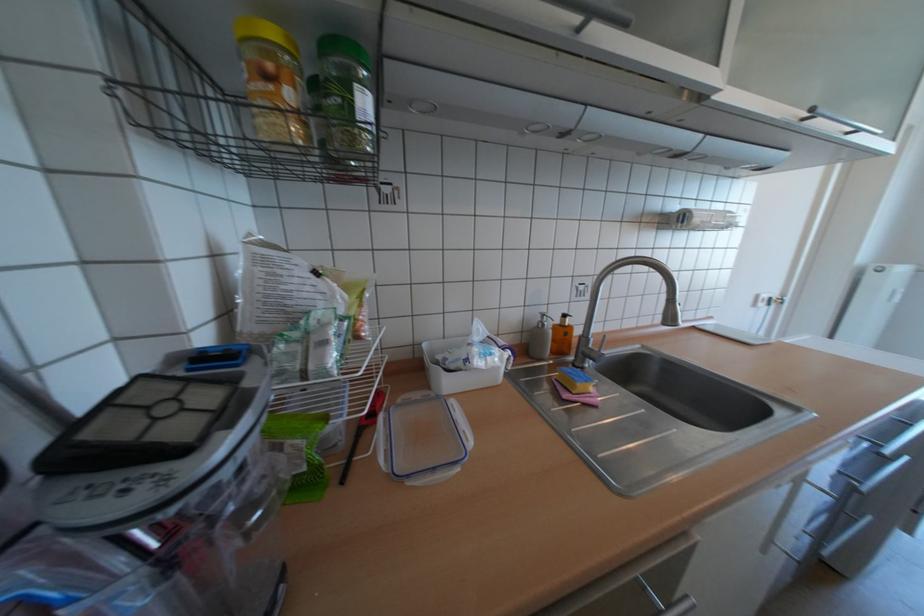
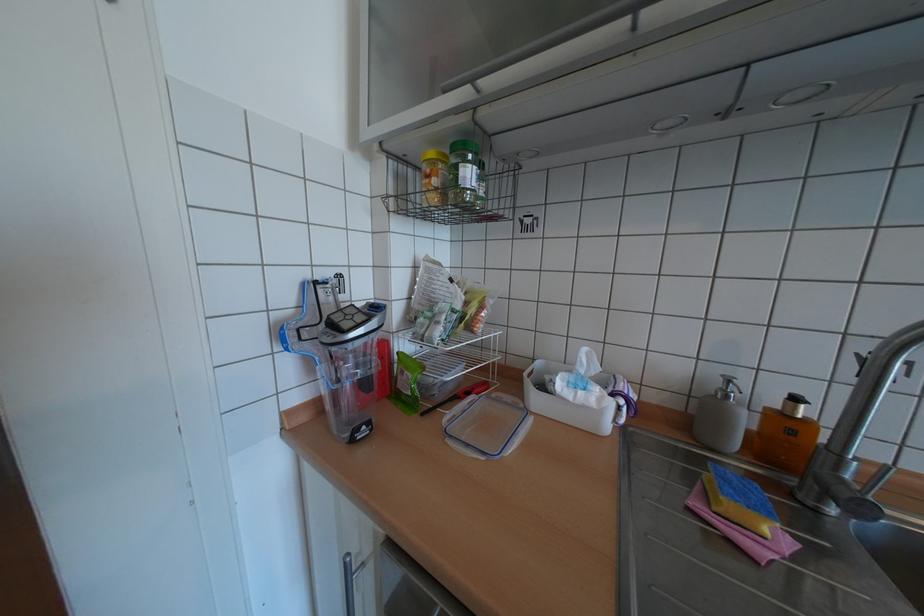
In the second image, find the point that corresponds to point (574, 315) in the first image.

(805, 399)